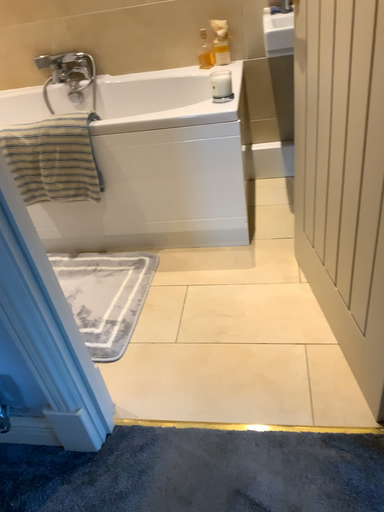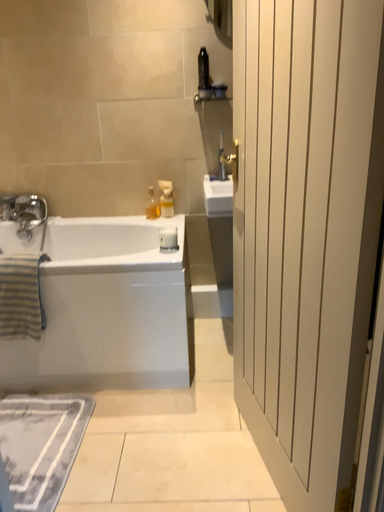
Question: How did the camera likely rotate when shooting the video?

Choices:
 (A) rotated left
 (B) rotated right

Answer: (B)